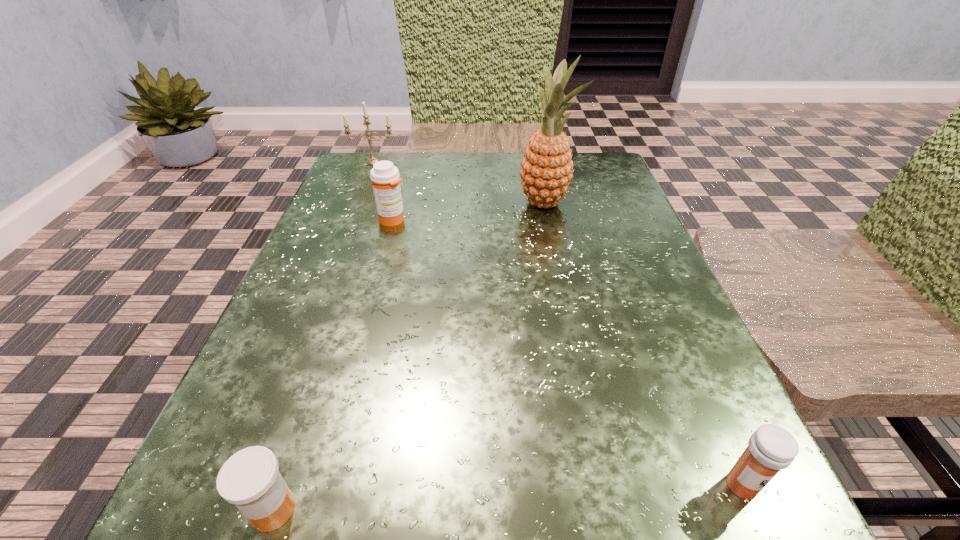
The height and width of the screenshot is (540, 960). In order to click on the tallest object in this screenshot , I will do `click(546, 171)`.

Where is `pineapple`? pineapple is located at coordinates (546, 171).

The image size is (960, 540). I want to click on the farthest object, so click(x=372, y=159).

Image resolution: width=960 pixels, height=540 pixels. Find the location of `candle`. candle is located at coordinates (372, 159).

Where is `the tallest medicine`? This screenshot has height=540, width=960. the tallest medicine is located at coordinates (385, 177).

You are a GUI agent. You are given a task and a screenshot of the screen. Output one action in this format:
    pyautogui.click(x=<x>, y=<y>)
    Task: Click on the farthest medicine
    This screenshot has height=540, width=960.
    Given the screenshot: What is the action you would take?
    pyautogui.click(x=385, y=177)

Locate an element on the screen. Image resolution: width=960 pixels, height=540 pixels. the rightmost medicine is located at coordinates (771, 448).

Identify the location of free spot located on the left of the fourth object from left to right. The image size is (960, 540). (444, 203).

You are a GUI agent. You are given a task and a screenshot of the screen. Output one action in this format:
    pyautogui.click(x=<x>, y=<y>)
    Task: Click on the free space located on the front of the farthest object
    
    Given the screenshot: What is the action you would take?
    pyautogui.click(x=358, y=200)

This screenshot has width=960, height=540. What are the coordinates of `vacant region located on the front of the tallest medicine` in the screenshot? It's located at (360, 343).